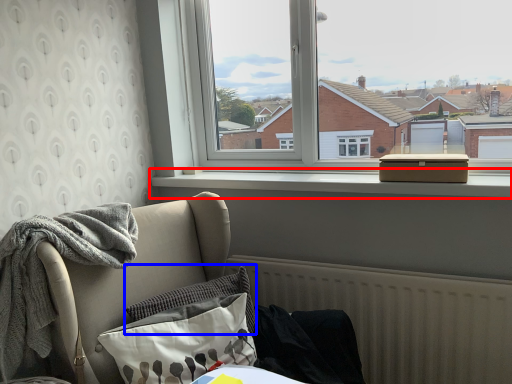
Question: Which object appears closest to the camera in this image, window sill (highlighted by a red box) or pillow (highlighted by a blue box)?

Choices:
 (A) window sill
 (B) pillow

Answer: (B)